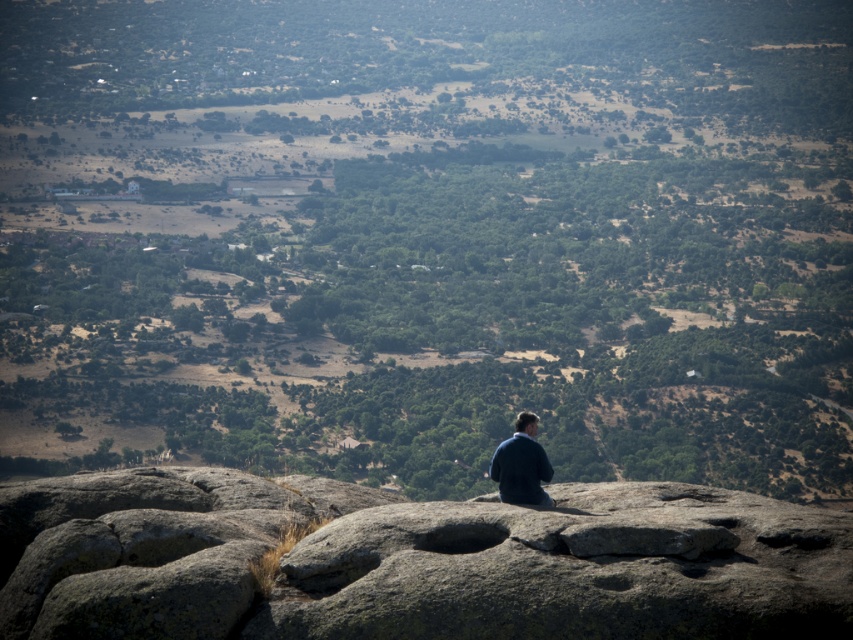
You are an explorer standing at the edge of the valley looking out. You see the gray rough rock at center and the dark blue fabric at center. Which object is wider?

The gray rough rock at center is wider than the dark blue fabric at center.

You are standing at the highest point of the rocky outcrop and want to determine which of the two points, point (403,544) or point (515,477), is closer to you. Based on the landscape described, which point should you choose?

Point (403,544) is closer to the viewer than point (515,477), so you should choose point (403,544).

You are a hiker standing at the edge of the valley looking out. You see the gray rough rock at center and the dark blue fabric at center. Which object is closer to you?

The gray rough rock at center is closer to you because it is in front of the dark blue fabric at center.